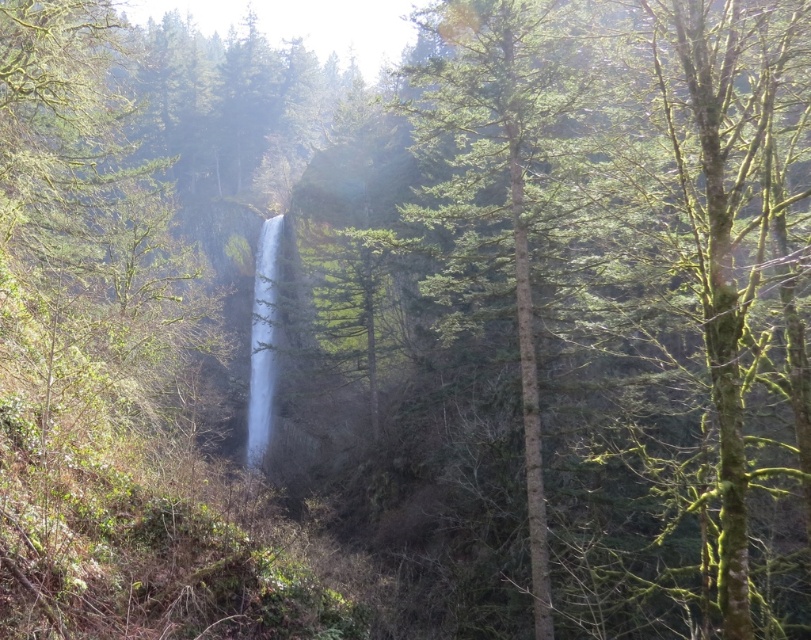
Question: Does green textured tree at center have a larger size compared to clear water at center?

Choices:
 (A) yes
 (B) no

Answer: (A)

Question: Which of the following is the closest to the observer?

Choices:
 (A) (513, 97)
 (B) (254, 413)

Answer: (A)

Question: Considering the relative positions of green textured tree at center and clear water at center in the image provided, where is green textured tree at center located with respect to clear water at center?

Choices:
 (A) left
 (B) right

Answer: (B)

Question: Does green textured tree at center appear on the right side of clear water at center?

Choices:
 (A) yes
 (B) no

Answer: (A)

Question: Among these objects, which one is nearest to the camera?

Choices:
 (A) clear water at center
 (B) green textured tree at center

Answer: (B)